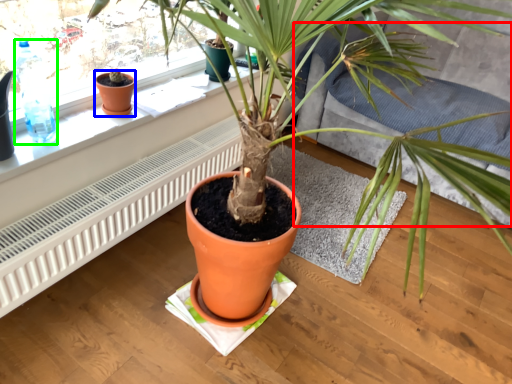
Question: Which is farther away from couch (highlighted by a red box)? flowerpot (highlighted by a blue box) or bottle (highlighted by a green box)?

Choices:
 (A) flowerpot
 (B) bottle

Answer: (B)